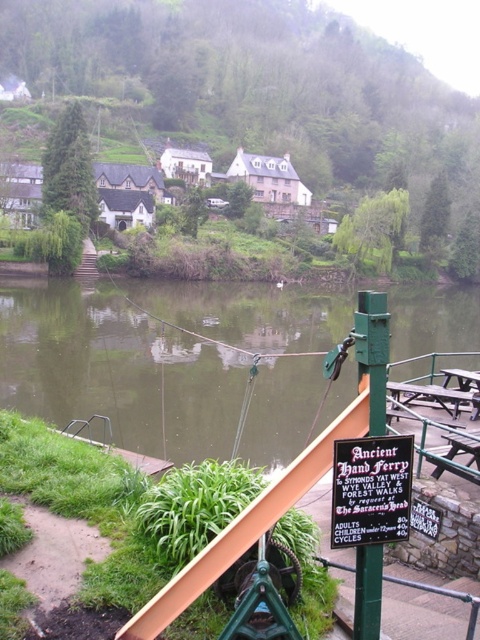
You are planning to picnic at the riverside and have brought a picnic basket. You see the green smooth water at center and the wooden picnic table at center. Which object is closer to the river?

The green smooth water at center is closer to the river than the wooden picnic table at center because it is located to the left of the table, which is typically near the water edge in such scenes.